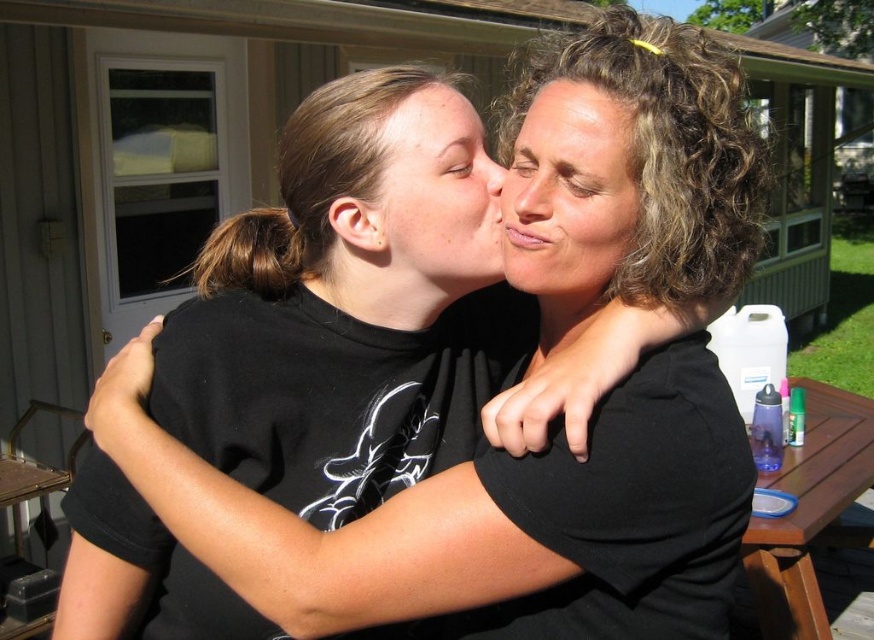
Is curly hair at center closer to the viewer compared to matte black face at center?

Answer: Yes.

What are the coordinates of `curly hair at center` in the screenshot? It's located at (569, 193).

The height and width of the screenshot is (640, 874). Describe the element at coordinates (569, 193) in the screenshot. I see `curly hair at center` at that location.

Locate an element on the screen. The image size is (874, 640). curly hair at center is located at coordinates (569, 193).

Between point (538, 216) and point (802, 451), which one is positioned behind?

Positioned behind is point (802, 451).

Consider the image. Which is more to the right, curly hair at center or brown wooden picnic table at right?

brown wooden picnic table at right is more to the right.

Is point (621, 208) in front of point (773, 600)?

Yes, it is.

Locate an element on the screen. Image resolution: width=874 pixels, height=640 pixels. curly hair at center is located at coordinates (569, 193).

Who is higher up, brown wooden picnic table at right or matte brown hair at upper center?

matte brown hair at upper center is above.

Can you confirm if brown wooden picnic table at right is shorter than matte brown hair at upper center?

No, brown wooden picnic table at right is not shorter than matte brown hair at upper center.

Where is `brown wooden picnic table at right`? This screenshot has width=874, height=640. brown wooden picnic table at right is located at coordinates (807, 509).